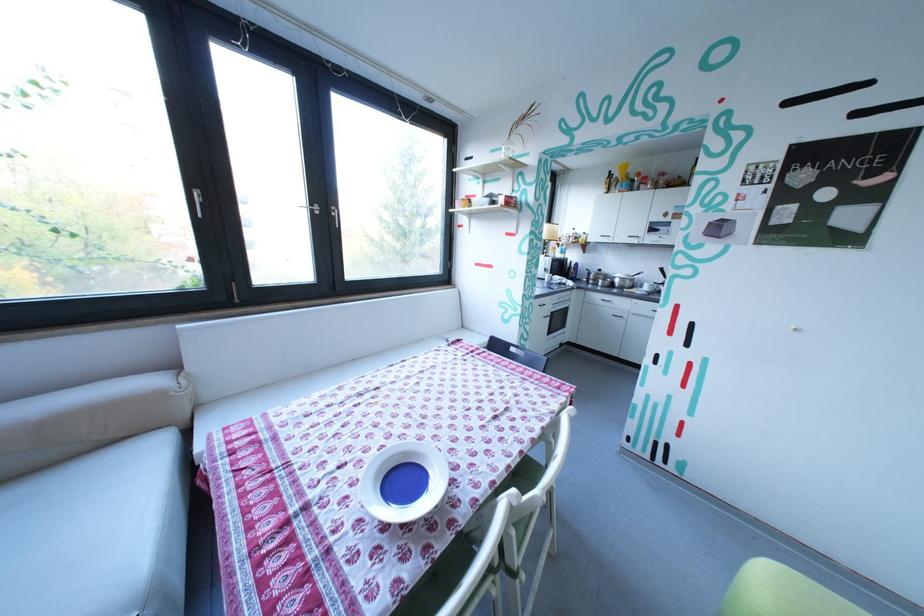
Where is `oven door handle`? oven door handle is located at coordinates (572, 323).